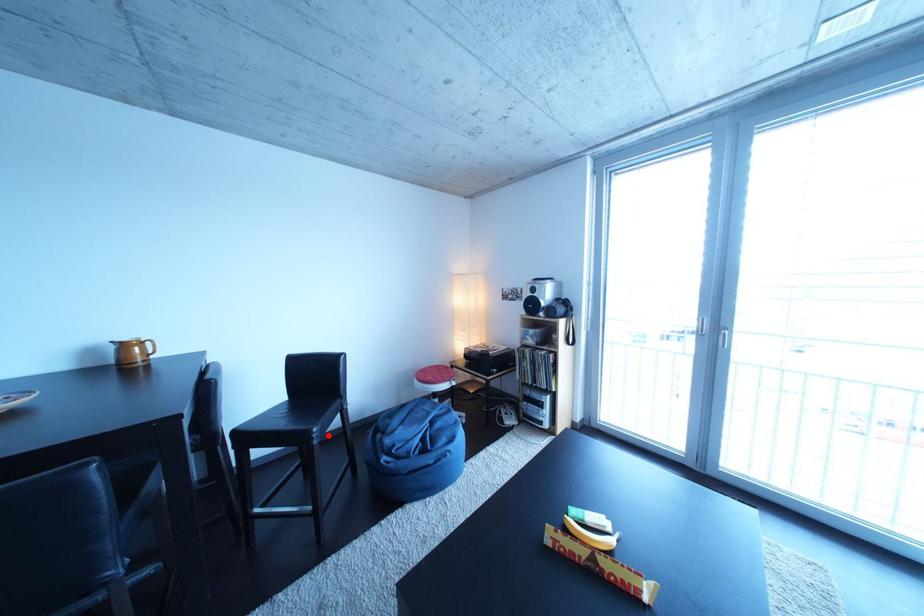
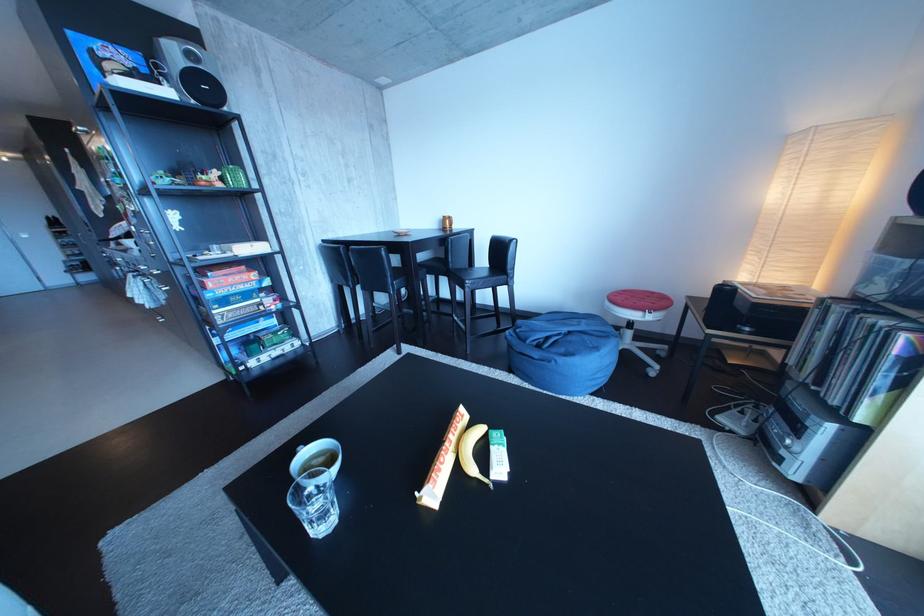
Where in the second image is the point corresponding to the highlighted location from the first image?

(480, 286)